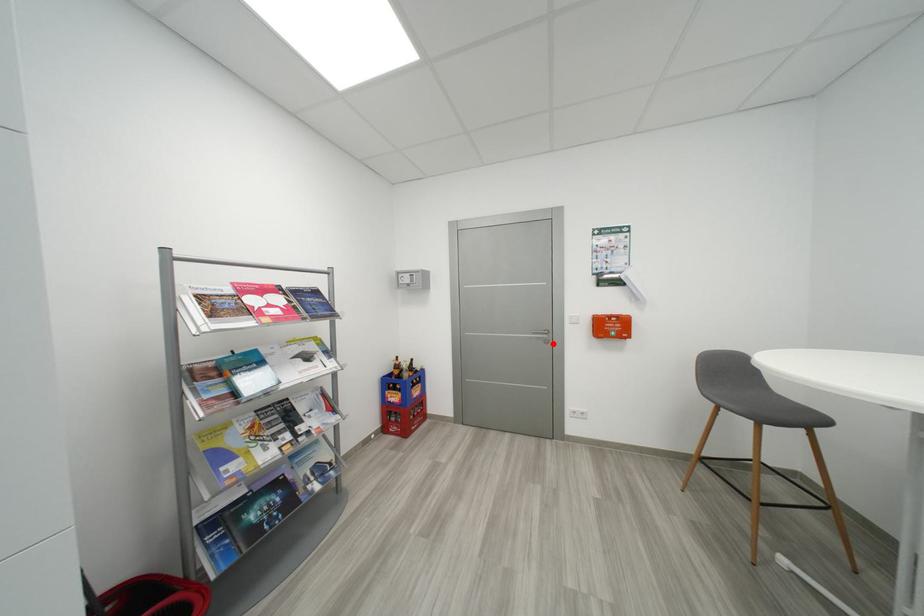
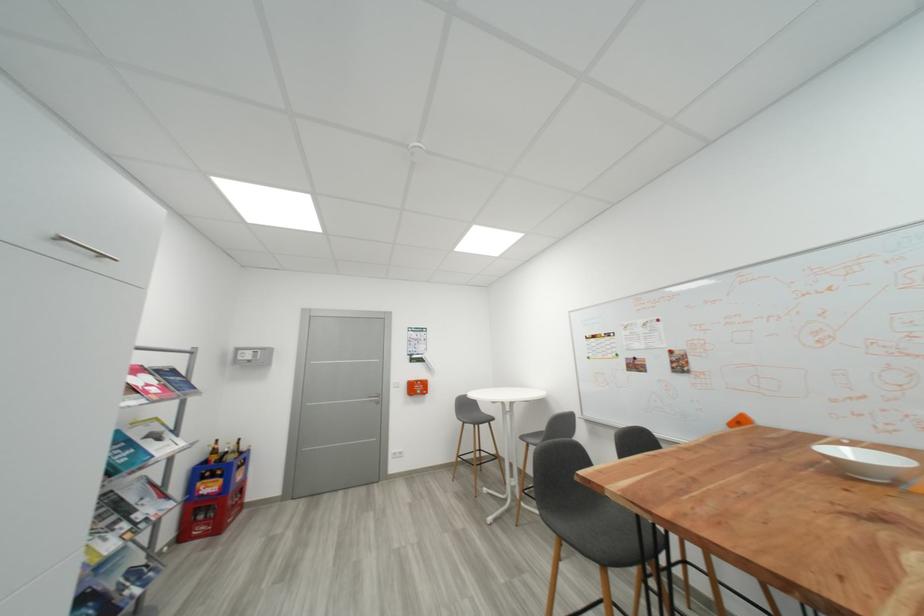
Where in the second image is the point corresponding to the highlighted location from the first image?

(383, 405)